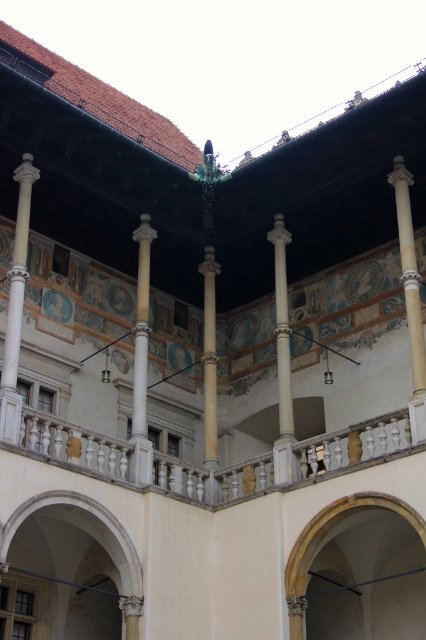
You are an architect examining the courtyard. You notice a point marked at coordinates [141,358]. What object is located at that point?

The point at coordinates [141,358] marks the location of the white marble column at center.